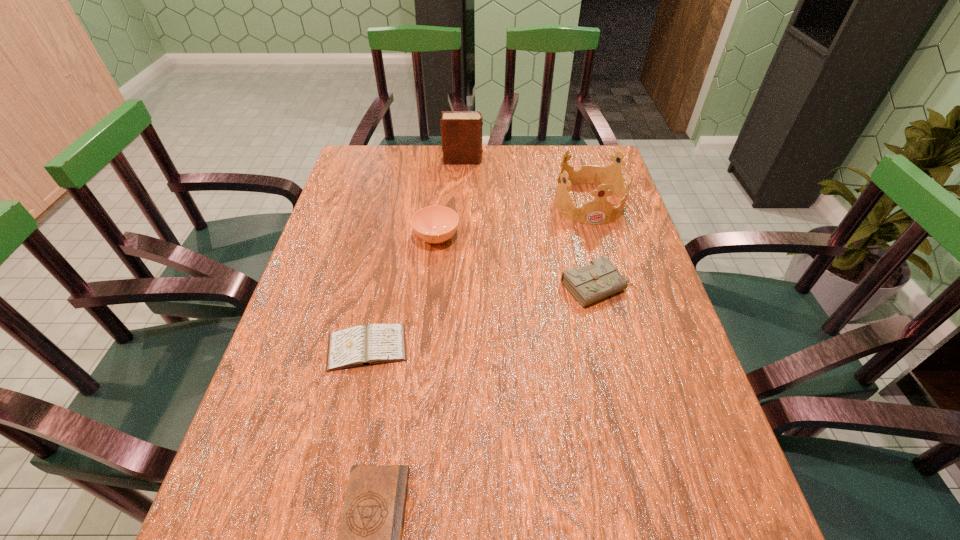
Identify which diary is the third nearest to the nearest object. Please provide its 2D coordinates. Your answer should be formatted as a tuple, i.e. [(x, y)], where the tuple contains the x and y coordinates of a point satisfying the conditions above.

[(461, 131)]

Identify the location of vacant space that satisfies the following two spatial constraints: 1. on the spine side of the tallest diary; 2. on the left side of the third nearest diary. (457, 287).

Where is `vacant space that satisfies the following two spatial constraints: 1. on the spine side of the tallest diary; 2. on the right side of the third shortest object`? vacant space that satisfies the following two spatial constraints: 1. on the spine side of the tallest diary; 2. on the right side of the third shortest object is located at coordinates (457, 287).

Where is `blank area in the image that satisfies the following two spatial constraints: 1. on the back side of the second nearest diary; 2. on the right side of the third shortest diary`? This screenshot has height=540, width=960. blank area in the image that satisfies the following two spatial constraints: 1. on the back side of the second nearest diary; 2. on the right side of the third shortest diary is located at coordinates (380, 287).